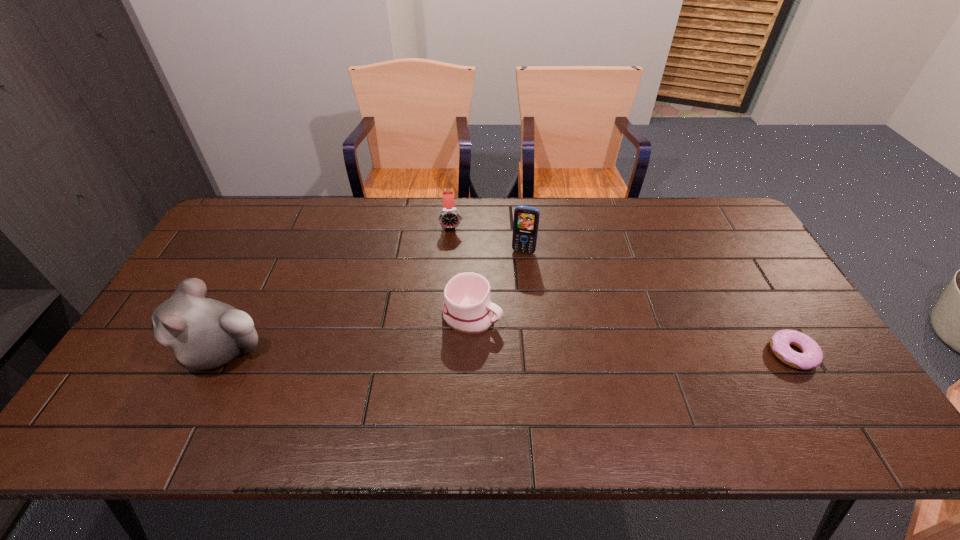
At what (x,y) coordinates should I click in order to perform the action: click on free spot on the desktop that is between the hamster and the doughnut and is positioned on the face of the watch. Please return your answer as a coordinate pair (x, y). The height and width of the screenshot is (540, 960). Looking at the image, I should click on (462, 352).

Locate an element on the screen. This screenshot has width=960, height=540. free space on the desktop that is between the hamster and the shortest object and is positioned on the side with the handle of the mug is located at coordinates (548, 353).

Where is `vacant space on the desktop that is between the hamster and the rightmost object and is positioned on the screen of the second farthest object`? vacant space on the desktop that is between the hamster and the rightmost object and is positioned on the screen of the second farthest object is located at coordinates (497, 352).